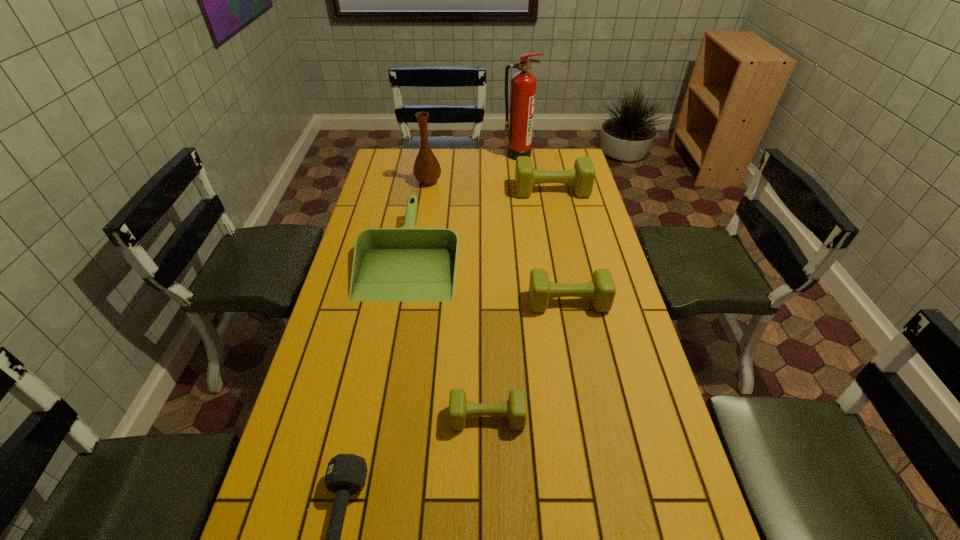
This screenshot has width=960, height=540. Find the location of `fire extinguisher`. fire extinguisher is located at coordinates (519, 127).

In order to click on the tallest object in this screenshot , I will do `click(519, 127)`.

You are a GUI agent. You are given a task and a screenshot of the screen. Output one action in this format:
    pyautogui.click(x=<x>, y=<y>)
    Task: Click on the second tallest object
    The image size is (960, 540).
    Given the screenshot: What is the action you would take?
    pyautogui.click(x=426, y=169)

In order to click on brown vase in this screenshot , I will do `click(426, 169)`.

This screenshot has width=960, height=540. I want to click on the fifth shortest object, so click(582, 176).

Locate an element on the screen. This screenshot has width=960, height=540. the farthest dumbbell is located at coordinates (582, 176).

What are the coordinates of `dustpan` in the screenshot? It's located at (408, 264).

Find the location of a particular element. This screenshot has height=540, width=960. the second smallest olive dumbbell is located at coordinates (601, 290).

Identify the location of the second farthest olive dumbbell. (601, 290).

Where is `the nearest olive dumbbell`? This screenshot has width=960, height=540. the nearest olive dumbbell is located at coordinates 514,409.